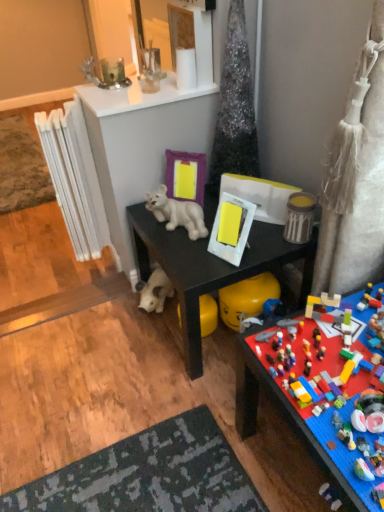
Where is `vacant area on top of multicolored plastic lego set at lower right, the 6th toy from the top (from a real-world perspective)`? The image size is (384, 512). vacant area on top of multicolored plastic lego set at lower right, the 6th toy from the top (from a real-world perspective) is located at coordinates (335, 367).